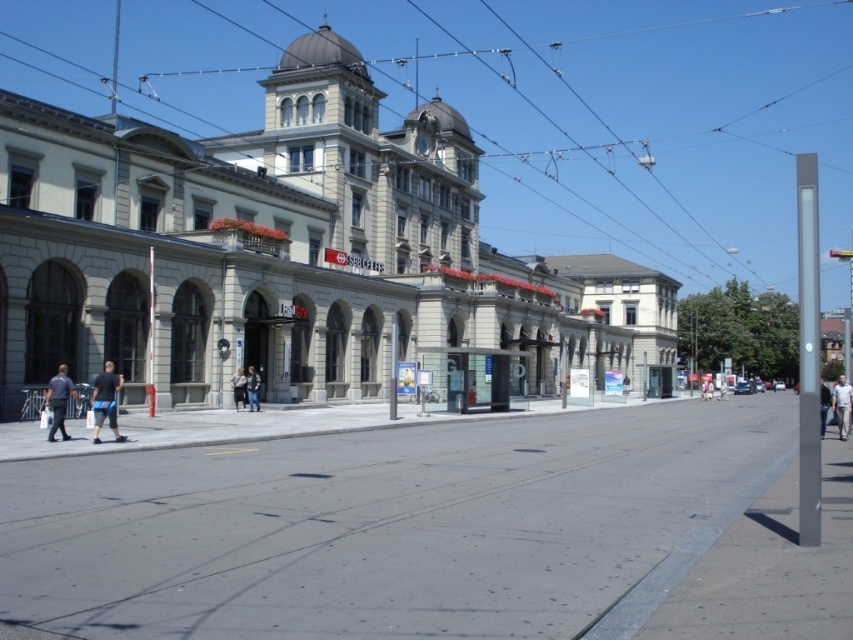
You are a photographer planning to take a photo of the historic building with its signage. You notice the metallic wire at upper center and the light blue jeans at center in the frame. Which object would you need to adjust your focus settings for to ensure clarity, considering their sizes in the image?

The metallic wire at upper center has a larger size compared to the light blue jeans at center, so you should adjust your focus settings for the metallic wire at upper center to ensure clarity due to its larger size in the frame.

You are standing in front of the historic building and want to take a photo. You notice two points marked on the building wall. The first point is at coordinate point (28, 465) and the second is at point (712, 390). If you want to focus on the closer point to ensure it appears sharp in your photo, which coordinate should you choose?

You should focus on point (28, 465) because it is closer to the camera than point (712, 390).